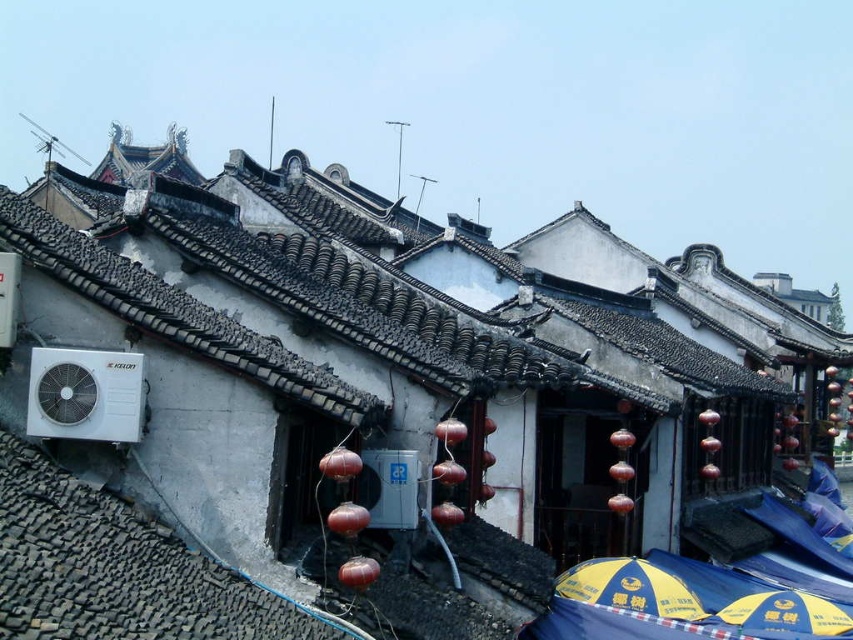
Is point (473, 349) behind point (560, 592)?

That is True.

Which of these two, dark gray tile roof at center or yellowmaterial/textureumbrella at lower center, stands shorter?

yellowmaterial/textureumbrella at lower center

Locate an element on the screen. The width and height of the screenshot is (853, 640). dark gray tile roof at center is located at coordinates (456, 273).